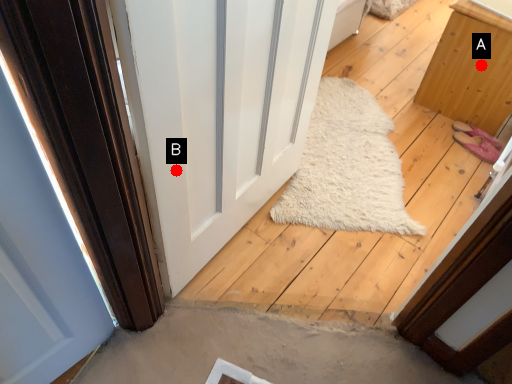
Question: Two points are circled on the image, labeled by A and B beside each circle. Which point is closer to the camera?

Choices:
 (A) A is closer
 (B) B is closer

Answer: (B)